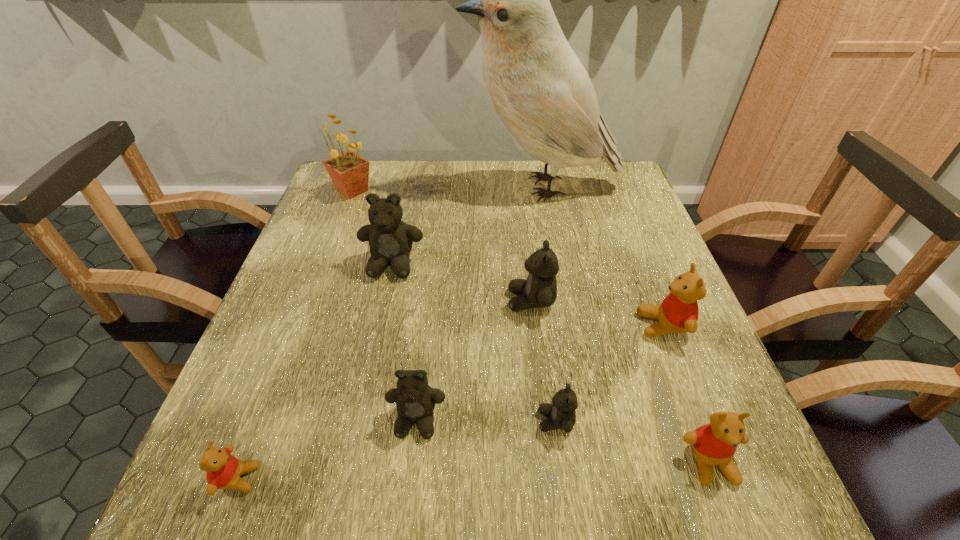
Where is `vacant area that lies between the leftmost teddy bear and the parakeet`? vacant area that lies between the leftmost teddy bear and the parakeet is located at coordinates click(x=389, y=333).

In order to click on object that is the closest to the third biggest brown teddy bear in this screenshot , I will do `click(561, 414)`.

I want to click on object that is the seventh closest to the biggest red teddy bear, so click(x=224, y=470).

Identify which teddy bear is the second closest to the leftmost red teddy bear. Please provide its 2D coordinates. Your answer should be formatted as a tuple, i.e. [(x, y)], where the tuple contains the x and y coordinates of a point satisfying the conditions above.

[(390, 239)]

Select which teddy bear appears as the closest to the parakeet. Please provide its 2D coordinates. Your answer should be formatted as a tuple, i.e. [(x, y)], where the tuple contains the x and y coordinates of a point satisfying the conditions above.

[(390, 239)]

I want to click on brown teddy bear that is the fourth closest to the eighth shortest object, so pyautogui.click(x=561, y=414).

The image size is (960, 540). Identify the location of brown teddy bear that is the third closest one to the smallest brown teddy bear. (390, 239).

Where is `red teddy bear that stands as the third closest to the sunflower`? The image size is (960, 540). red teddy bear that stands as the third closest to the sunflower is located at coordinates (715, 443).

Locate which red teddy bear is the third closest to the second biggest brown teddy bear. Please provide its 2D coordinates. Your answer should be formatted as a tuple, i.e. [(x, y)], where the tuple contains the x and y coordinates of a point satisfying the conditions above.

[(224, 470)]

Identify the location of free space that satisfies the following two spatial constraints: 1. at the front of the second tallest object with flowers visible; 2. on the front-facing side of the leftmost teddy bear. (245, 478).